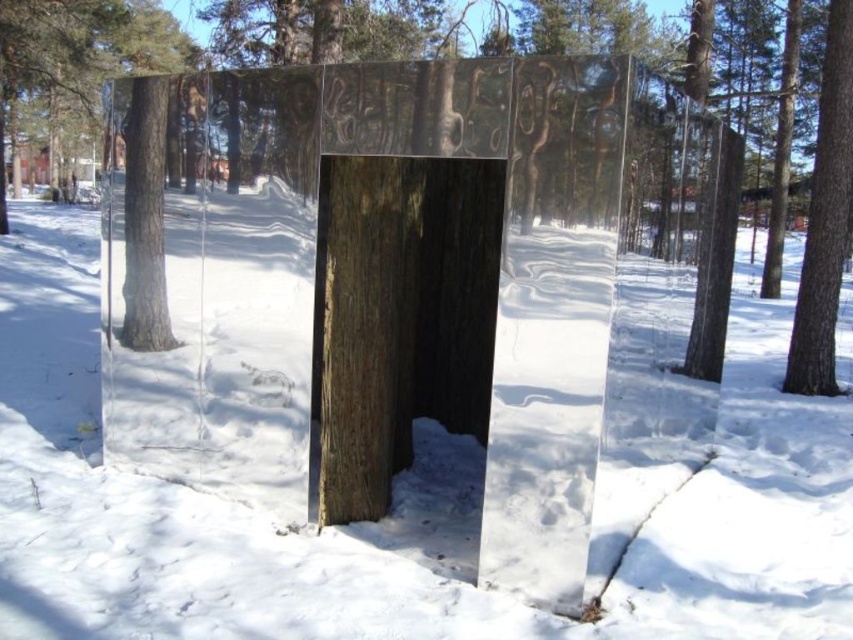
Question: Among these points, which one is farthest from the camera?

Choices:
 (A) (721, 392)
 (B) (828, 52)

Answer: (B)

Question: Among these objects, which one is farthest from the camera?

Choices:
 (A) white snow at center
 (B) transparent wood at center
 (C) smooth brown bark at right

Answer: (C)

Question: In this image, where is white snow at center located relative to brown rough wood at center?

Choices:
 (A) left
 (B) right

Answer: (A)

Question: Which point is closer to the camera?

Choices:
 (A) (820, 168)
 (B) (457, 403)

Answer: (B)

Question: Does white snow at center have a greater width compared to smooth brown bark at right?

Choices:
 (A) yes
 (B) no

Answer: (A)

Question: From the image, what is the correct spatial relationship of white snow at center in relation to transparent wood at center?

Choices:
 (A) above
 (B) below

Answer: (B)